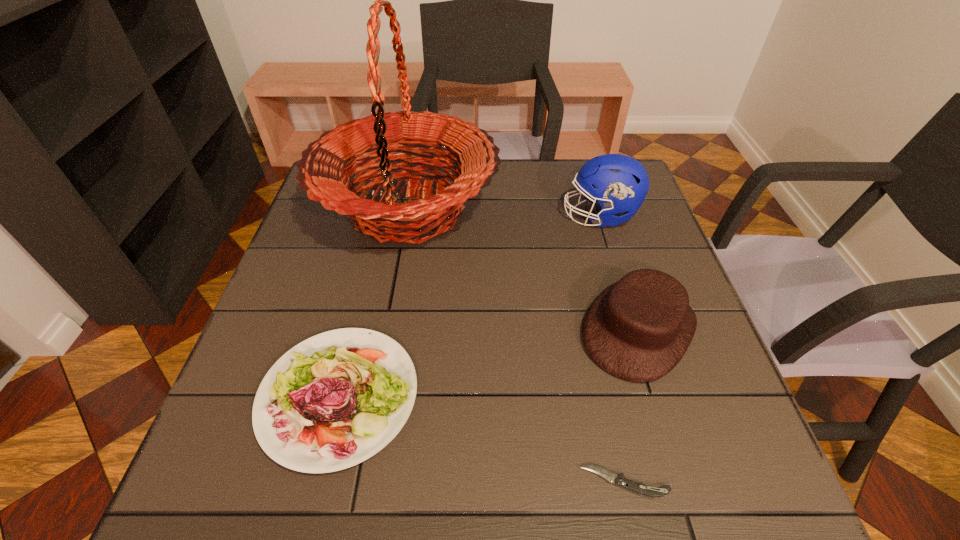
The height and width of the screenshot is (540, 960). Identify the location of vacant point that satisfies the following two spatial constraints: 1. on the back side of the shortest object; 2. on the right side of the hat. (590, 329).

At what (x,y) coordinates should I click in order to perform the action: click on blank area in the image that satisfies the following two spatial constraints: 1. on the front-facing side of the second tallest object; 2. on the front side of the fourth tallest object. Please return your answer as a coordinate pair (x, y). Looking at the image, I should click on (655, 396).

I want to click on vacant point that satisfies the following two spatial constraints: 1. on the front-facing side of the football helmet; 2. on the front side of the pocketknife, so click(x=681, y=482).

Find the location of a particular element. vacant area that satisfies the following two spatial constraints: 1. on the front-facing side of the hat; 2. on the right side of the football helmet is located at coordinates (634, 329).

This screenshot has width=960, height=540. What are the coordinates of `blank area in the image that satisfies the following two spatial constraints: 1. on the back side of the tallest object; 2. on the right side of the second shortest object` in the screenshot? It's located at (385, 209).